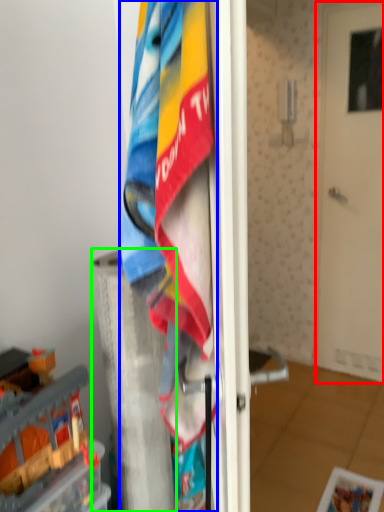
Question: Based on their relative distances, which object is nearer to door (highlighted by a red box)? Choose from towel (highlighted by a blue box) and pillar (highlighted by a green box).

Choices:
 (A) towel
 (B) pillar

Answer: (B)